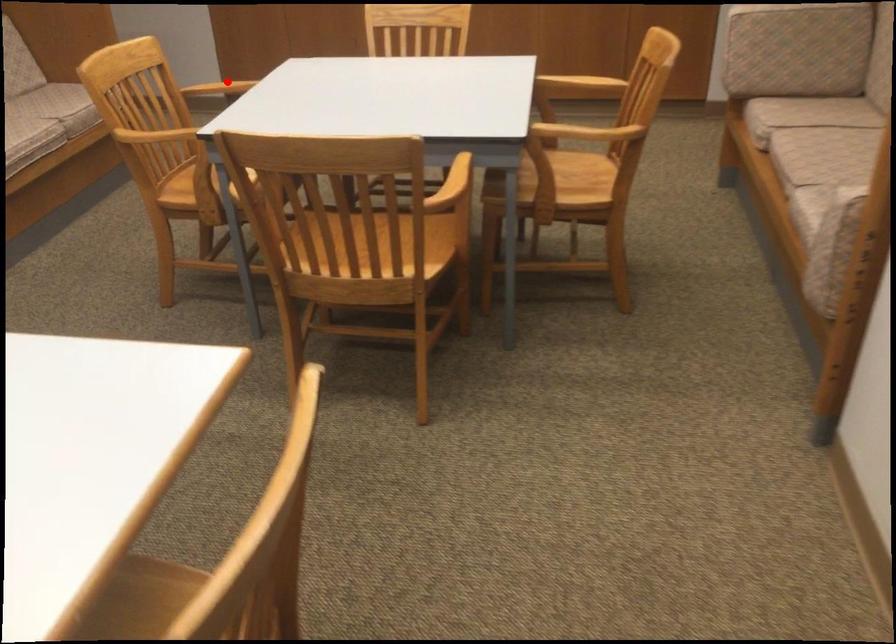
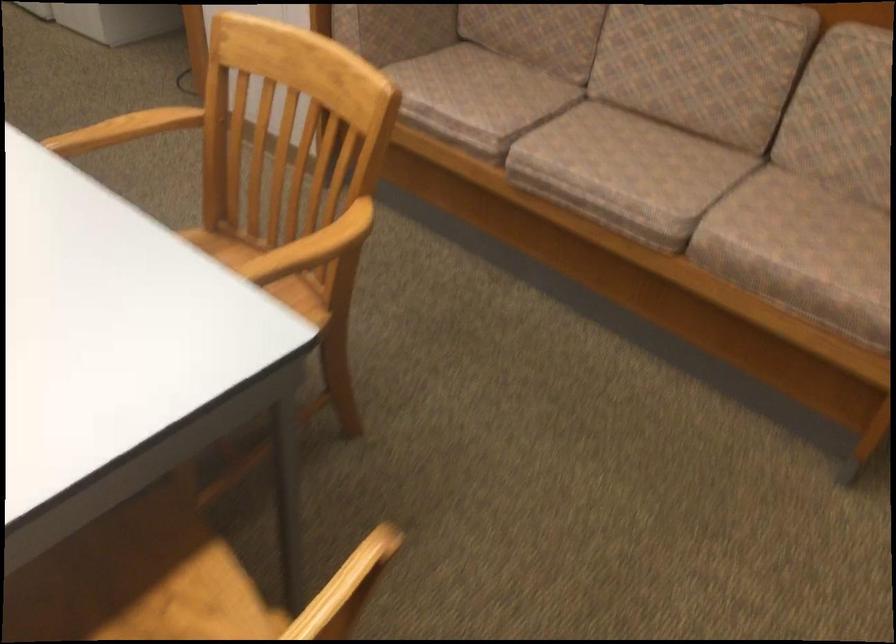
Question: I am providing you with two images of the same scene from different viewpoints. Image1 has a red point marked. In image2, the corresponding 3D location appears at what relative position? Reply with the corresponding letter.

Choices:
 (A) Closer
 (B) Farther

Answer: (A)